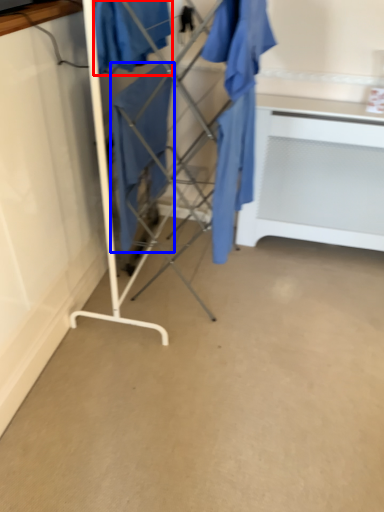
Question: Which point is further to the camera, clothing (highlighted by a red box) or clothing (highlighted by a blue box)?

Choices:
 (A) clothing
 (B) clothing

Answer: (B)